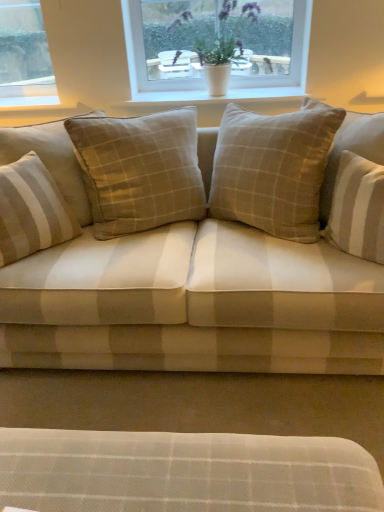
Measure the distance between beige striped cushion at left, the first pillow positioned from the left, and camera.

beige striped cushion at left, the first pillow positioned from the left, is 4.93 feet from camera.

What do you see at coordinates (31, 210) in the screenshot?
I see `beige striped cushion at left, the first pillow positioned from the left` at bounding box center [31, 210].

Where is `beige plaid fabric couch at center`? beige plaid fabric couch at center is located at coordinates (192, 264).

Is white plastic window at upper center at the back of beige checkered pillow at center, which appears as the 1th pillow when viewed from the right?

beige checkered pillow at center, which appears as the 1th pillow when viewed from the right, does not have its back to white plastic window at upper center.

Does point (148, 184) come in front of point (172, 42)?

Yes, it is in front of point (172, 42).

Between beige checkered pillow at center, which appears as the 1th pillow when viewed from the right, and white plastic window at upper center, which one appears on the right side from the viewer's perspective?

white plastic window at upper center.

Which object is wider, beige checkered pillow at center, positioned as the 2th pillow in left-to-right order, or white plastic window at upper center?

Wider between the two is beige checkered pillow at center, positioned as the 2th pillow in left-to-right order.

Which of these two, beige plaid fabric couch at center or beige striped cushion at left, the first pillow positioned from the left, stands taller?

Standing taller between the two is beige plaid fabric couch at center.

From a real-world perspective, is beige plaid fabric couch at center positioned under beige striped cushion at left, placed as the second pillow when sorted from right to left, based on gravity?

Indeed, from a real-world perspective, beige plaid fabric couch at center is positioned beneath beige striped cushion at left, placed as the second pillow when sorted from right to left.

From the image's perspective, who appears lower, beige plaid fabric couch at center or beige striped cushion at left, placed as the second pillow when sorted from right to left?

beige striped cushion at left, placed as the second pillow when sorted from right to left.

Considering the positions of point (55, 239) and point (172, 316), is point (55, 239) closer or farther from the camera than point (172, 316)?

Clearly, point (55, 239) is more distant from the camera than point (172, 316).

Based on the photo, is beige striped cushion at left, placed as the second pillow when sorted from right to left, thinner than beige plaid fabric couch at center?

Correct, the width of beige striped cushion at left, placed as the second pillow when sorted from right to left, is less than that of beige plaid fabric couch at center.

From the image's perspective, which is above, beige striped cushion at left, placed as the second pillow when sorted from right to left, or beige plaid fabric couch at center?

beige plaid fabric couch at center appears higher in the image.

Considering the relative positions of beige striped cushion at left, placed as the second pillow when sorted from right to left, and beige plaid fabric couch at center in the image provided, is beige striped cushion at left, placed as the second pillow when sorted from right to left, to the left or to the right of beige plaid fabric couch at center?

From the image, it's evident that beige striped cushion at left, placed as the second pillow when sorted from right to left, is to the left of beige plaid fabric couch at center.

Is beige striped cushion at left, the first pillow positioned from the left, thinner than white smooth window sill at upper center?

In fact, beige striped cushion at left, the first pillow positioned from the left, might be wider than white smooth window sill at upper center.

Between beige striped cushion at left, the first pillow positioned from the left, and white smooth window sill at upper center, which one has less height?

Standing shorter between the two is white smooth window sill at upper center.

Considering the points (64, 199) and (133, 106), which point is behind, point (64, 199) or point (133, 106)?

The point (133, 106) is behind.

Looking at this image, can you see beige striped cushion at left, the first pillow positioned from the left, touching white smooth window sill at upper center?

No, beige striped cushion at left, the first pillow positioned from the left, is not next to white smooth window sill at upper center.

Which is further, (27, 223) or (234, 30)?

Result: Positioned behind is point (234, 30).

Is beige striped cushion at left, placed as the second pillow when sorted from right to left, at the left side of white plastic window at upper center?

Yes.

Is beige striped cushion at left, placed as the second pillow when sorted from right to left, further to the viewer compared to white plastic window at upper center?

No.

Can you confirm if beige striped cushion at left, placed as the second pillow when sorted from right to left, is thinner than white plastic window at upper center?

In fact, beige striped cushion at left, placed as the second pillow when sorted from right to left, might be wider than white plastic window at upper center.

From the image's perspective, who appears lower, white plastic window at upper center or beige checkered pillow at center, positioned as the 2th pillow in left-to-right order?

beige checkered pillow at center, positioned as the 2th pillow in left-to-right order.

Does white plastic window at upper center come in front of beige checkered pillow at center, positioned as the 2th pillow in left-to-right order?

No, white plastic window at upper center is further to the viewer.

Considering the relative sizes of white plastic window at upper center and beige checkered pillow at center, positioned as the 2th pillow in left-to-right order, in the image provided, is white plastic window at upper center taller than beige checkered pillow at center, positioned as the 2th pillow in left-to-right order,?

In fact, white plastic window at upper center may be shorter than beige checkered pillow at center, positioned as the 2th pillow in left-to-right order.

Is beige checkered pillow at center, which appears as the 1th pillow when viewed from the right, at the back of white plastic window at upper center?

No, white plastic window at upper center is not facing the opposite direction of beige checkered pillow at center, which appears as the 1th pillow when viewed from the right.

Does white plastic window at upper center have a smaller size compared to beige striped cushion at left, the first pillow positioned from the left?

Yes.

Considering the sizes of objects white plastic window at upper center and beige striped cushion at left, the first pillow positioned from the left, in the image provided, who is thinner, white plastic window at upper center or beige striped cushion at left, the first pillow positioned from the left,?

white plastic window at upper center is thinner.

From a real-world perspective, is white plastic window at upper center over beige striped cushion at left, placed as the second pillow when sorted from right to left?

Yes, from a real-world perspective, white plastic window at upper center is above beige striped cushion at left, placed as the second pillow when sorted from right to left.

Is point (171, 29) positioned before point (35, 155)?

No, (171, 29) is further to viewer.

The image size is (384, 512). Find the location of `the 1st pillow positioned below the white plastic window at upper center (from a real-world perspective)`. the 1st pillow positioned below the white plastic window at upper center (from a real-world perspective) is located at coordinates (139, 170).

Which pillow is the 1st one when counting from the back of the beige plaid fabric couch at center? Please provide its 2D coordinates.

[(31, 210)]

Which object lies further to the anchor point beige striped cushion at left, the first pillow positioned from the left, white plastic window at upper center or beige checkered pillow at center, which appears as the 1th pillow when viewed from the right?

Among the two, white plastic window at upper center is located further to beige striped cushion at left, the first pillow positioned from the left.

When comparing their distances from white smooth window sill at upper center, does beige striped cushion at left, placed as the second pillow when sorted from right to left, or white plastic window at upper center seem closer?

Based on the image, white plastic window at upper center appears to be nearer to white smooth window sill at upper center.

Considering their positions, is white plastic window at upper center positioned closer to beige striped cushion at left, placed as the second pillow when sorted from right to left, than beige plaid fabric couch at center?

Among the two, beige plaid fabric couch at center is located nearer to beige striped cushion at left, placed as the second pillow when sorted from right to left.

Looking at this image, which object lies further to the anchor point beige plaid fabric couch at center, beige checkered pillow at center, positioned as the 2th pillow in left-to-right order, or white smooth window sill at upper center?

white smooth window sill at upper center is positioned further to the anchor beige plaid fabric couch at center.

Which object lies nearer to the anchor point beige checkered pillow at center, positioned as the 2th pillow in left-to-right order, beige striped cushion at left, the first pillow positioned from the left, or white smooth window sill at upper center?

beige striped cushion at left, the first pillow positioned from the left, lies closer to beige checkered pillow at center, positioned as the 2th pillow in left-to-right order, than the other object.

From the image, which object appears to be farther from white smooth window sill at upper center, beige striped cushion at left, placed as the second pillow when sorted from right to left, or beige plaid fabric couch at center?

beige striped cushion at left, placed as the second pillow when sorted from right to left, is further to white smooth window sill at upper center.

In the scene shown: Based on their spatial positions, is white smooth window sill at upper center or white plastic window at upper center closer to beige plaid fabric couch at center?

The object closer to beige plaid fabric couch at center is white smooth window sill at upper center.

Which object lies further to the anchor point beige plaid fabric couch at center, white plastic window at upper center or beige checkered pillow at center, positioned as the 2th pillow in left-to-right order?

white plastic window at upper center is further to beige plaid fabric couch at center.

At what (x,y) coordinates should I click in order to perform the action: click on pillow between beige striped cushion at left, placed as the second pillow when sorted from right to left, and white smooth window sill at upper center from front to back. Please return your answer as a coordinate pair (x, y). The height and width of the screenshot is (512, 384). Looking at the image, I should click on (139, 170).

Where is `pillow between white plastic window at upper center and beige striped cushion at left, the first pillow positioned from the left, from top to bottom`? Image resolution: width=384 pixels, height=512 pixels. pillow between white plastic window at upper center and beige striped cushion at left, the first pillow positioned from the left, from top to bottom is located at coordinates (139, 170).

Where is `window positioned between beige plaid fabric couch at center and white smooth window sill at upper center from near to far`? window positioned between beige plaid fabric couch at center and white smooth window sill at upper center from near to far is located at coordinates click(216, 48).

The height and width of the screenshot is (512, 384). Identify the location of pillow situated between beige striped cushion at left, placed as the second pillow when sorted from right to left, and beige plaid fabric couch at center from left to right. (139, 170).